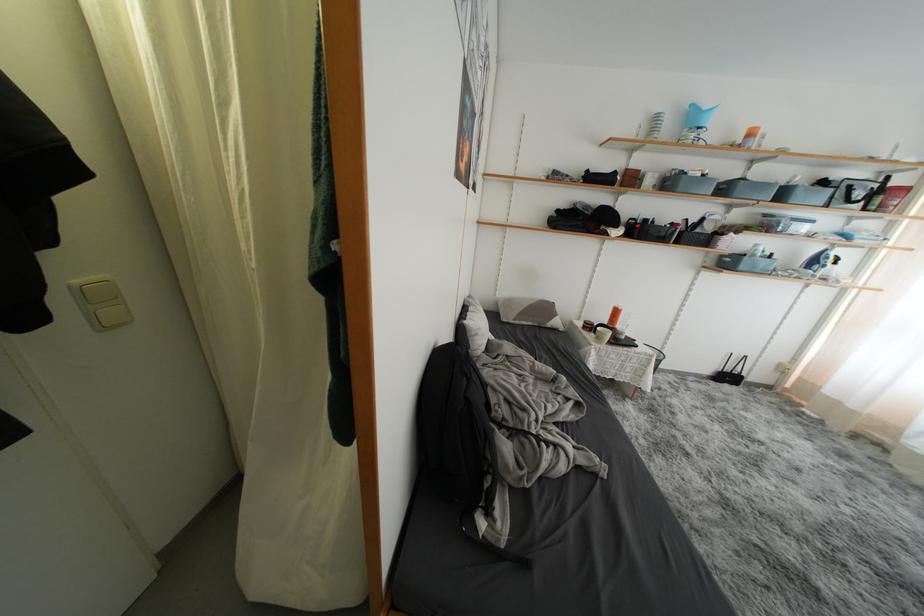
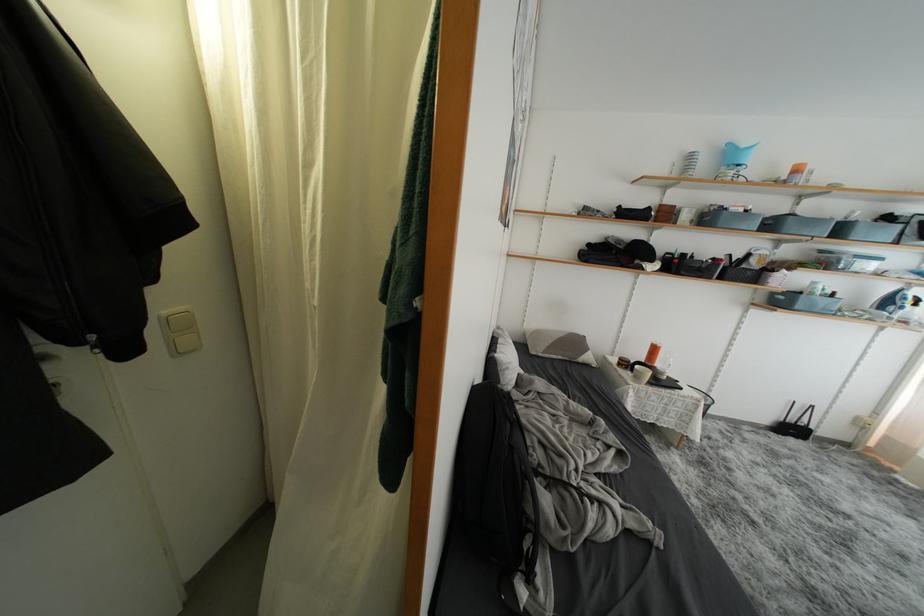
The point at [734,381] is marked in the first image. Where is the corresponding point in the second image?

(797, 434)